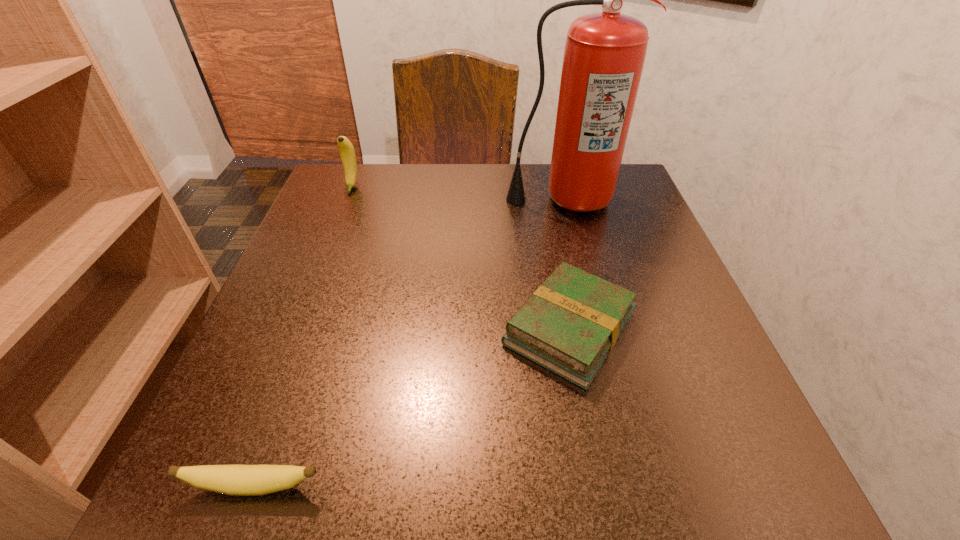
Find the location of a particular element. Image resolution: width=960 pixels, height=540 pixels. free space between the tallest object and the third shortest object is located at coordinates (458, 193).

Choose which object is the second nearest neighbor to the second nearest object. Please provide its 2D coordinates. Your answer should be formatted as a tuple, i.e. [(x, y)], where the tuple contains the x and y coordinates of a point satisfying the conditions above.

[(237, 480)]

The height and width of the screenshot is (540, 960). I want to click on object that is the second closest one to the tallest object, so click(346, 149).

You are a GUI agent. You are given a task and a screenshot of the screen. Output one action in this format:
    pyautogui.click(x=<x>, y=<y>)
    Task: Click on the free space that satisfies the following two spatial constraints: 1. from the stem of the farther banana; 2. on the left side of the shorter banana
    
    Given the screenshot: What is the action you would take?
    pyautogui.click(x=233, y=487)

Where is `free space in the image that satisfies the following two spatial constraints: 1. from the stem of the taller banana; 2. on the left side of the book`? This screenshot has height=540, width=960. free space in the image that satisfies the following two spatial constraints: 1. from the stem of the taller banana; 2. on the left side of the book is located at coordinates (296, 328).